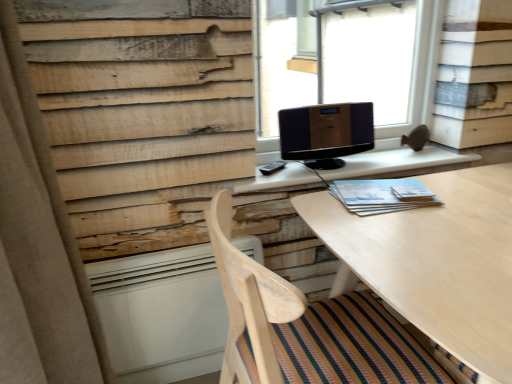
Question: Does point (23, 304) appear closer or farther from the camera than point (407, 66)?

Choices:
 (A) farther
 (B) closer

Answer: (B)

Question: From a real-world perspective, is beige fabric curtain at left above or below transparent glass speaker at upper center?

Choices:
 (A) below
 (B) above

Answer: (A)

Question: Which object is the closest to the white matte radiator at lower left?

Choices:
 (A) light wood table at center
 (B) matte wooden table at center
 (C) shiny black monitor at center
 (D) light blue paper at right
 (E) transparent glass speaker at upper center

Answer: (B)

Question: Considering the real-world distances, which object is closest to the beige fabric curtain at left?

Choices:
 (A) white matte radiator at lower left
 (B) transparent glass speaker at upper center
 (C) light blue paper at right
 (D) wooden chair at lower center
 (E) light wood table at center

Answer: (A)